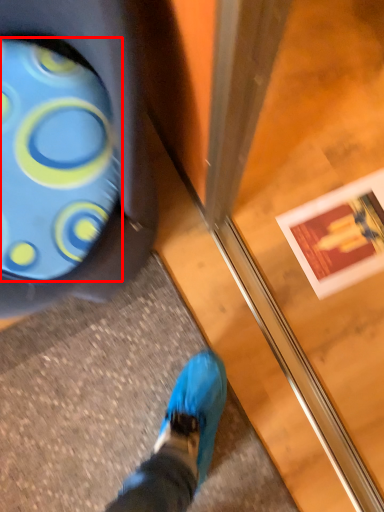
Question: Considering the relative positions of footwear (annotated by the red box) and screen door in the image provided, where is footwear (annotated by the red box) located with respect to the staircase?

Choices:
 (A) right
 (B) left

Answer: (B)